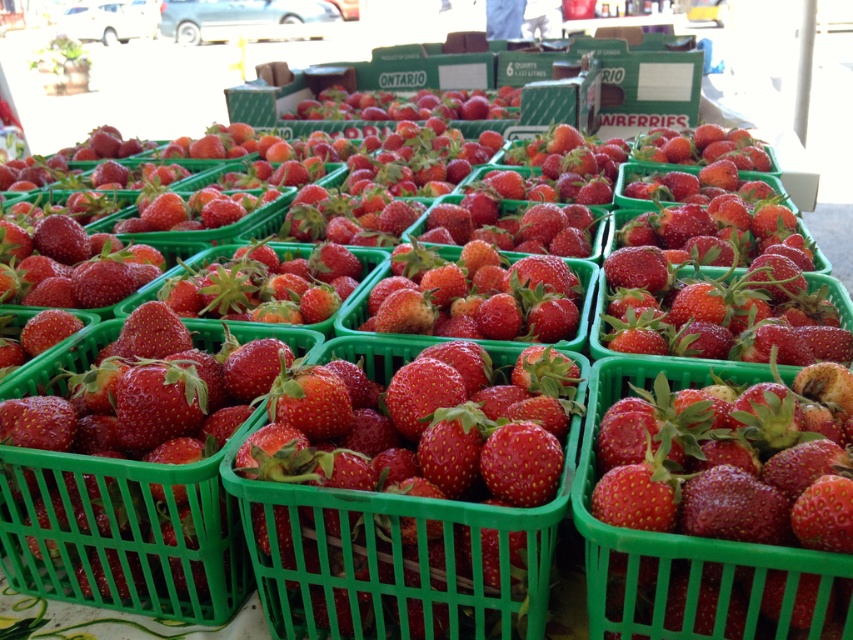
Question: Does glossy plastic strawberries at center lie behind glossy plastic basket at center?

Choices:
 (A) yes
 (B) no

Answer: (B)

Question: Among these objects, which one is farthest from the camera?

Choices:
 (A) glossy plastic strawberries at center
 (B) glossy plastic basket at center

Answer: (B)

Question: Is glossy plastic strawberries at center positioned before glossy plastic basket at center?

Choices:
 (A) yes
 (B) no

Answer: (A)

Question: Which of the following is the farthest from the observer?

Choices:
 (A) glossy plastic basket at center
 (B) glossy plastic strawberries at center

Answer: (A)

Question: Is glossy plastic strawberries at center further to camera compared to glossy plastic basket at center?

Choices:
 (A) no
 (B) yes

Answer: (A)